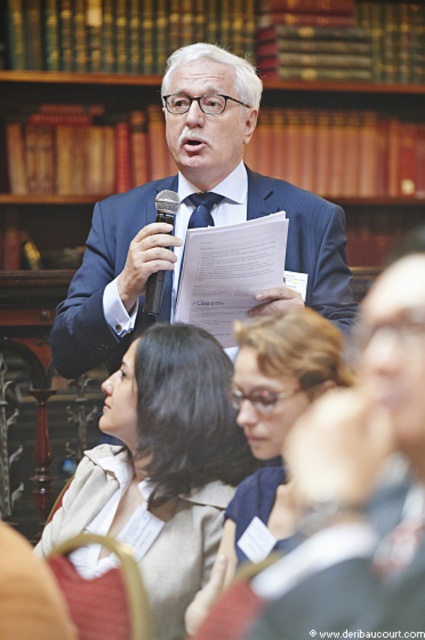
Can you confirm if smooth beige sweater at lower center is bigger than matte blue shirt at center?

Correct, smooth beige sweater at lower center is larger in size than matte blue shirt at center.

Who is shorter, smooth beige sweater at lower center or matte blue shirt at center?

matte blue shirt at center is shorter.

Locate an element on the screen. This screenshot has width=425, height=640. smooth beige sweater at lower center is located at coordinates (161, 467).

Is point (153, 394) closer to viewer compared to point (198, 211)?

Yes, point (153, 394) is in front of point (198, 211).

Can you confirm if smooth beige sweater at lower center is smaller than blue silk tie at center?

No, smooth beige sweater at lower center is not smaller than blue silk tie at center.

At what (x,y) coordinates should I click in order to perform the action: click on smooth beige sweater at lower center. Please return your answer as a coordinate pair (x, y). The width and height of the screenshot is (425, 640). Looking at the image, I should click on (161, 467).

Can you confirm if blue suit at center is positioned below smooth beige sweater at lower center?

Incorrect, blue suit at center is not positioned below smooth beige sweater at lower center.

What do you see at coordinates (192, 216) in the screenshot? The image size is (425, 640). I see `blue suit at center` at bounding box center [192, 216].

Who is more distant from viewer, (121, 312) or (227, 483)?

The point (121, 312) is more distant.

This screenshot has height=640, width=425. What are the coordinates of `blue suit at center` in the screenshot? It's located at (192, 216).